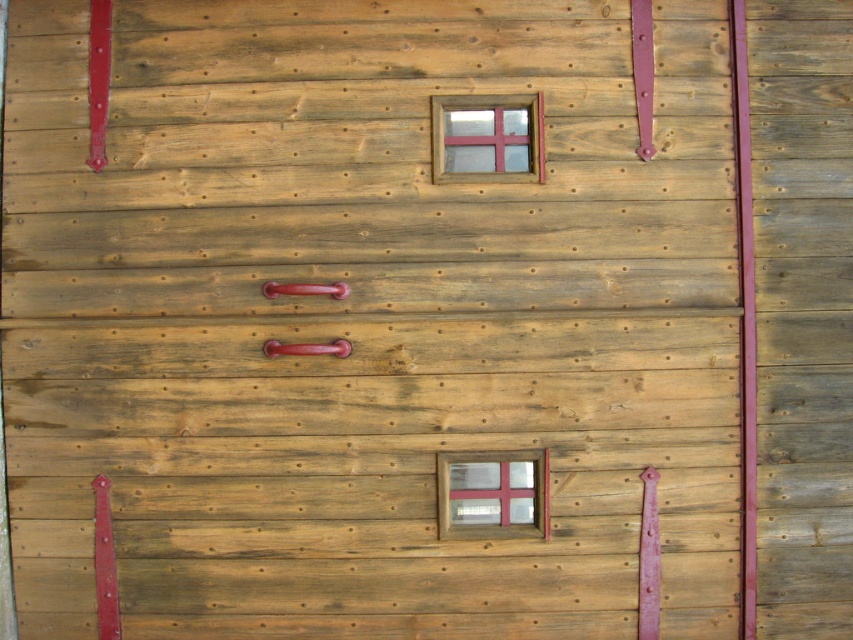
You are standing in front of the wooden structure and want to open the wooden frame window at center. Which direction should you move the glossy metal handle at center to open the window?

The wooden frame window at center is positioned under the glossy metal handle at center, so you should pull the glossy metal handle at center downward to open the window.

You are trying to decide which handle to use to open the door. The glossy metal handle at center and the shiny red metal handle at center are both in the same location. Which handle is wider?

The glossy metal handle at center is wider than the shiny red metal handle at center because the glossy metal handle at center surpasses the shiny red metal handle at center in width.